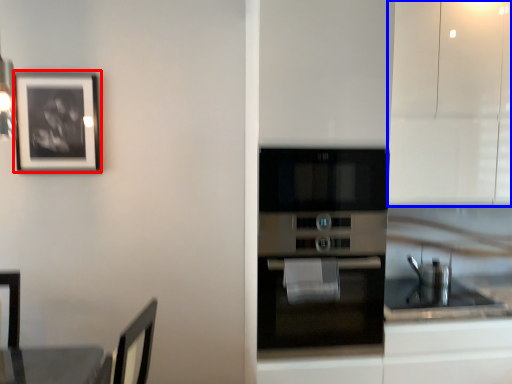
Question: Among these objects, which one is nearest to the camera, picture frame (highlighted by a red box) or cabinetry (highlighted by a blue box)?

Choices:
 (A) picture frame
 (B) cabinetry

Answer: (B)